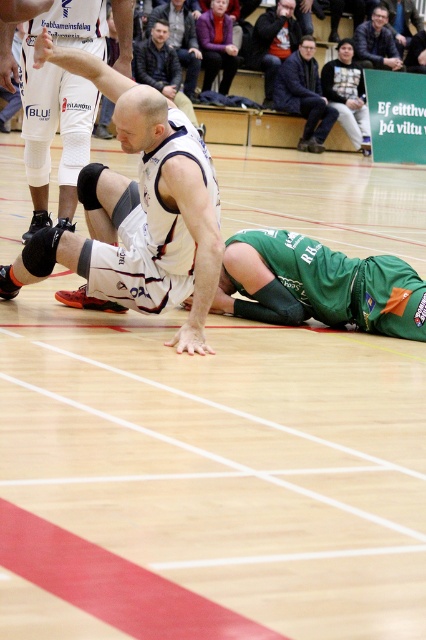
Is point (203, 304) in front of point (373, 24)?

That is True.

The width and height of the screenshot is (426, 640). Describe the element at coordinates (293, 276) in the screenshot. I see `white jersey at center` at that location.

Find the location of `white jersey at center`. white jersey at center is located at coordinates (293, 276).

Consider the image. Is dark gray jacket at upper center shorter than dark blue textured jacket at upper right?

Incorrect, dark gray jacket at upper center's height does not fall short of dark blue textured jacket at upper right's.

Is dark gray jacket at upper center smaller than dark blue textured jacket at upper right?

No, dark gray jacket at upper center is not smaller than dark blue textured jacket at upper right.

Between point (267, 28) and point (354, 33), which one is positioned behind?

Positioned behind is point (354, 33).

Identify the location of dark gray jacket at upper center. (273, 42).

In the scene shown: Can you confirm if white matte basketball player at center is positioned to the right of dark blue jacket at upper center?

In fact, white matte basketball player at center is to the left of dark blue jacket at upper center.

Does point (132, 32) come in front of point (276, 76)?

That is True.

Measure the distance between white matte basketball player at center and camera.

white matte basketball player at center is 23.70 feet from camera.

In order to click on white matte basketball player at center in this screenshot , I will do `click(60, 106)`.